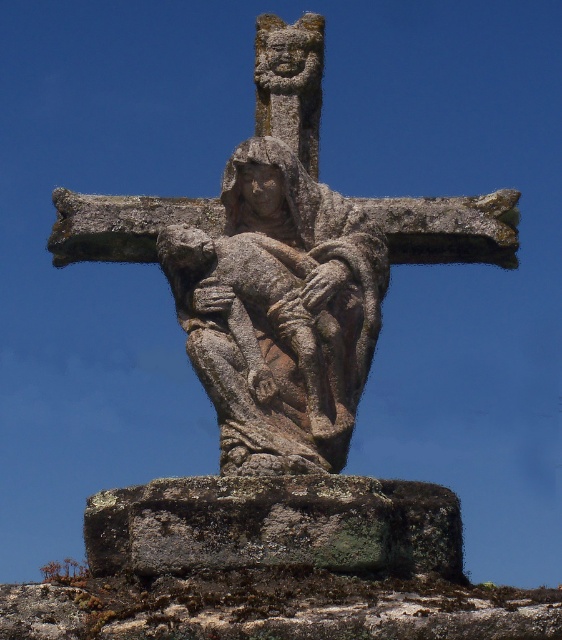
Question: Which point is closer to the camera taking this photo?

Choices:
 (A) (505, 230)
 (B) (314, 496)

Answer: (B)

Question: Is rough stone sculpture at center positioned behind lichen-covered stone at center?

Choices:
 (A) yes
 (B) no

Answer: (A)

Question: Is rough stone sculpture at center above lichen-covered stone at center?

Choices:
 (A) yes
 (B) no

Answer: (A)

Question: Does rough stone sculpture at center appear under lichen-covered stone at center?

Choices:
 (A) yes
 (B) no

Answer: (B)

Question: Which point is farther from the camera taking this photo?

Choices:
 (A) (429, 500)
 (B) (278, 416)

Answer: (B)